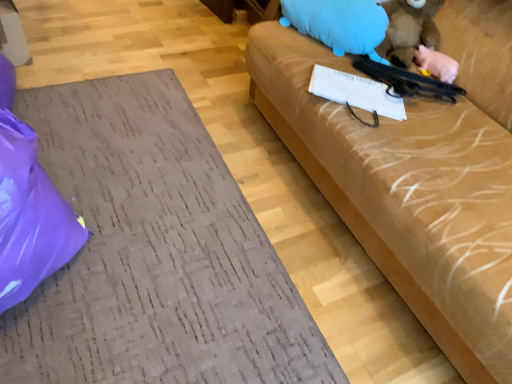
Question: Is blue plush toy at upper right, placed as the third animal when sorted from right to left, situated inside purple plastic bag at lower left or outside?

Choices:
 (A) inside
 (B) outside

Answer: (B)

Question: From their relative heights in the image, would you say blue plush toy at upper right, placed as the third animal when sorted from right to left, is taller or shorter than purple plastic bag at lower left?

Choices:
 (A) short
 (B) tall

Answer: (A)

Question: Which of these objects is positioned farthest from the fuzzy brown animal at upper right, the second animal positioned from the right?

Choices:
 (A) brown fabric couch at right
 (B) matte brown couch at right
 (C) pink rubber pig at upper right, arranged as the 3th animal when viewed from the left
 (D) blue plush toy at upper right, placed as the third animal when sorted from right to left
 (E) purple plastic bag at lower left

Answer: (E)

Question: Estimate the real-world distances between objects in this image. Which object is closer to the pink rubber pig at upper right, which appears as the 1th animal when viewed from the right?

Choices:
 (A) matte brown couch at right
 (B) blue plush toy at upper right, placed as the third animal when sorted from right to left
 (C) brown fabric couch at right
 (D) purple plastic bag at lower left
 (E) fuzzy brown animal at upper right, positioned as the 2th animal in left-to-right order

Answer: (E)